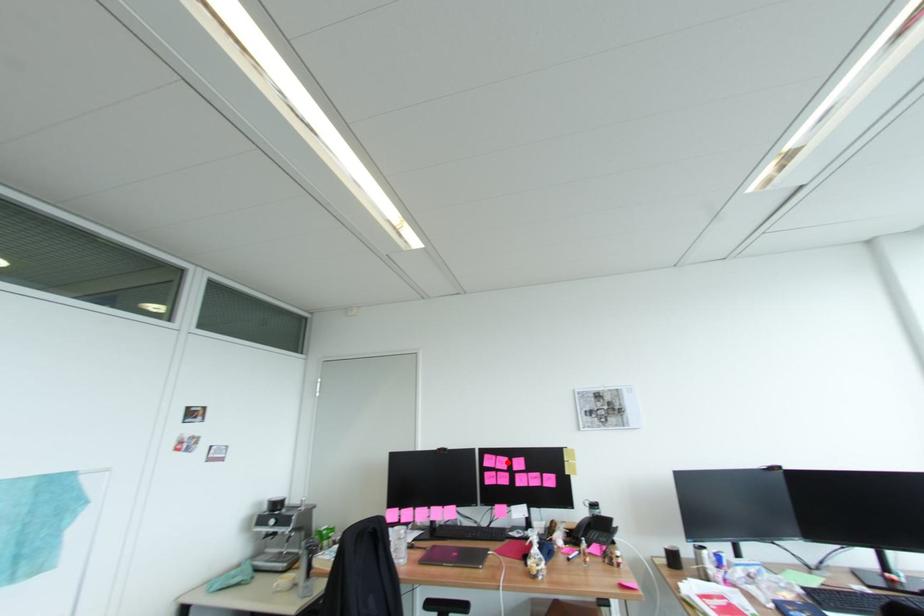
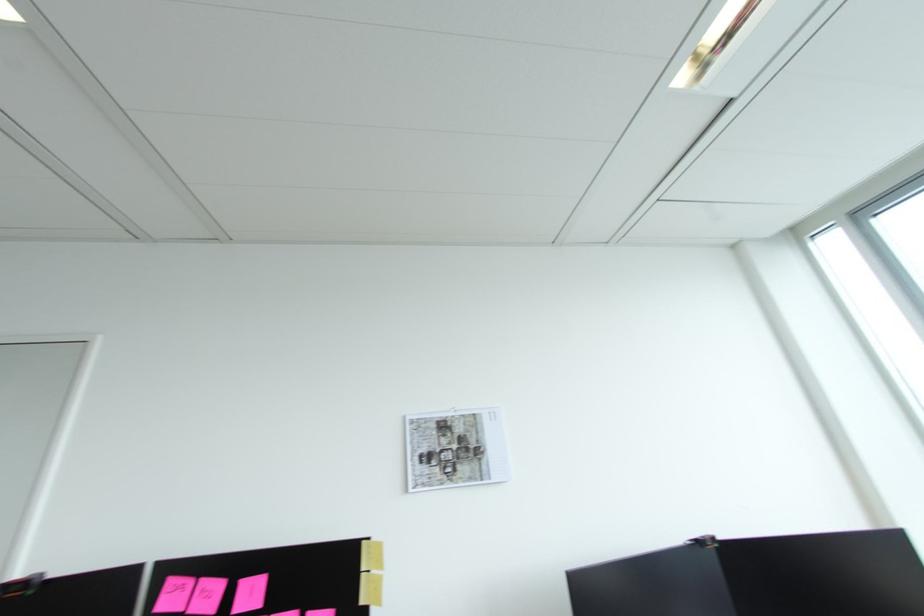
Locate, in the second image, the point that corresponds to the highlighted location in the first image.

(213, 594)